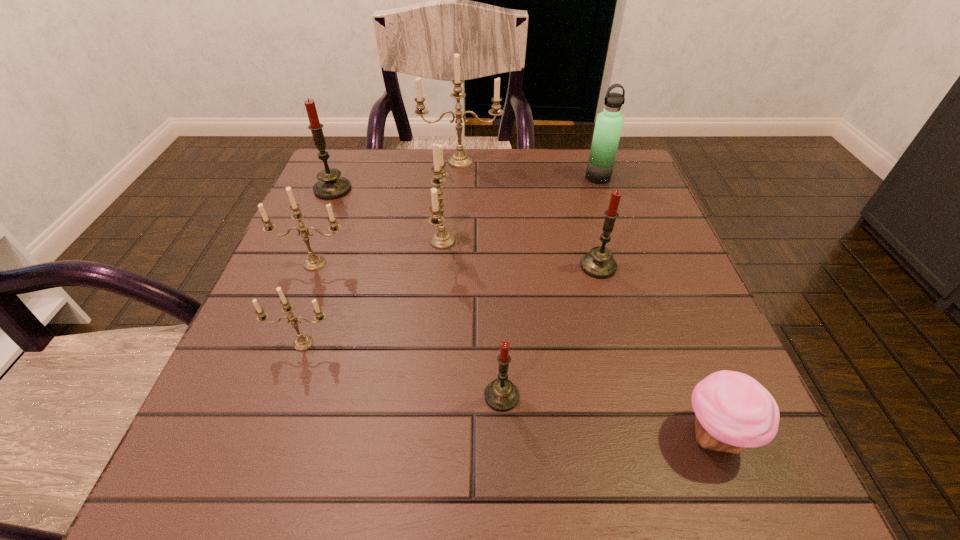
Locate an element on the screen. vacant point that satisfies the following two spatial constraints: 1. on the front side of the thermos bottle; 2. on the left side of the cupcake is located at coordinates (687, 435).